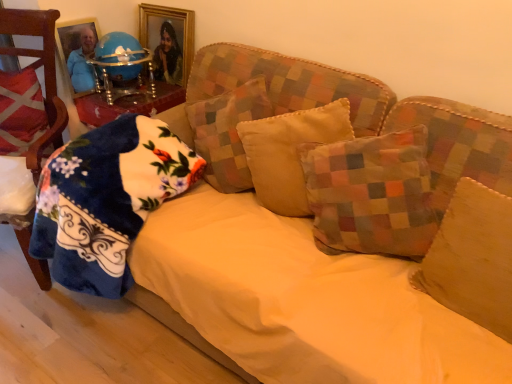
Question: Looking at their shapes, would you say fluffy blue blanket at left, the second pillow in the left-to-right sequence, is wider or thinner than red plaid pillow at left, the first pillow when ordered from left to right?

Choices:
 (A) thin
 (B) wide

Answer: (B)

Question: Is fluffy blue blanket at left, the second pillow in the left-to-right sequence, in front of or behind red plaid pillow at left, which ranks as the sixth pillow in right-to-left order, in the image?

Choices:
 (A) front
 (B) behind

Answer: (A)

Question: Which of these objects is positioned closest to the yellow fabric sheet at center?

Choices:
 (A) velvet beige pillow at center, the fourth pillow when ordered from left to right
 (B) fluffy blue blanket at left, the second pillow in the left-to-right sequence
 (C) patchwork fabric pillow at center, the 4th pillow viewed from the right
 (D) suede-like beige pillow at center-right, the sixth pillow in the left-to-right sequence
 (E) gold-framed picture at upper center

Answer: (A)

Question: Which is farther from the velvet beige pillow at center, which ranks as the third pillow in right-to-left order?

Choices:
 (A) suede-like beige pillow at center-right, marked as the 1th pillow in a right-to-left arrangement
 (B) multicolored patchwork pillow at center, marked as the second pillow in a right-to-left arrangement
 (C) fluffy blue blanket at left, the second pillow in the left-to-right sequence
 (D) patchwork fabric pillow at center, positioned as the 3th pillow in left-to-right order
 (E) red plaid pillow at left, which ranks as the sixth pillow in right-to-left order

Answer: (E)